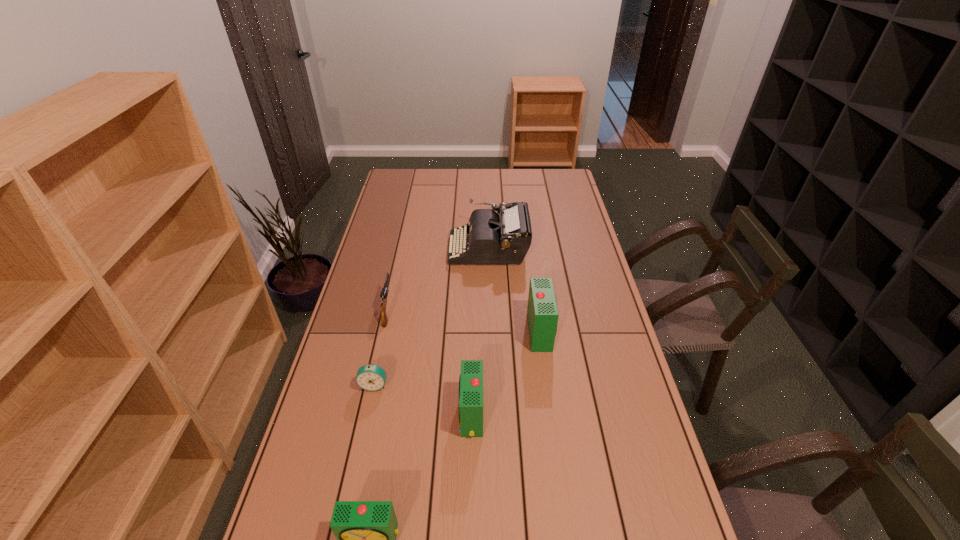
The height and width of the screenshot is (540, 960). What are the coordinates of `free region at the right edge` in the screenshot? It's located at (577, 297).

I want to click on blank space at the far left corner of the desktop, so click(x=398, y=183).

The image size is (960, 540). In the image, there is a desktop. Find the location of `free space at the far right corner`. free space at the far right corner is located at coordinates (547, 192).

The image size is (960, 540). In the image, there is a desktop. Identify the location of free space at the near right corner. (675, 523).

Locate an element on the screen. free area in between the gun and the farthest object is located at coordinates (439, 279).

Image resolution: width=960 pixels, height=540 pixels. I want to click on free space between the shortest alarm clock and the gun, so click(381, 347).

This screenshot has width=960, height=540. What are the coordinates of `free space that is in between the typewriter and the second alarm clock from right to left` in the screenshot? It's located at (480, 332).

I want to click on vacant space in between the gun and the shortest alarm clock, so click(x=381, y=347).

This screenshot has width=960, height=540. I want to click on vacant space in between the second alarm clock from right to left and the rightmost alarm clock, so click(506, 373).

Locate an element on the screen. free space between the shortest alarm clock and the second tallest alarm clock is located at coordinates (422, 400).